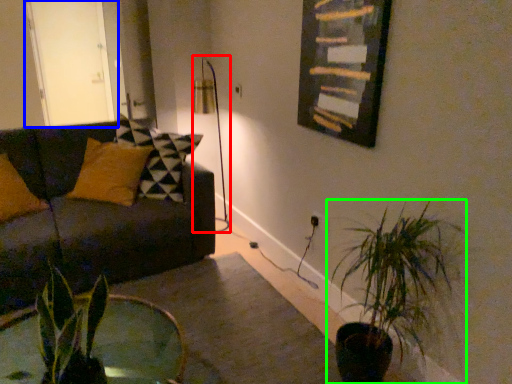
Question: Which is farther away from table lamp (highlighted by a red box)? glass door (highlighted by a blue box) or houseplant (highlighted by a green box)?

Choices:
 (A) glass door
 (B) houseplant

Answer: (B)